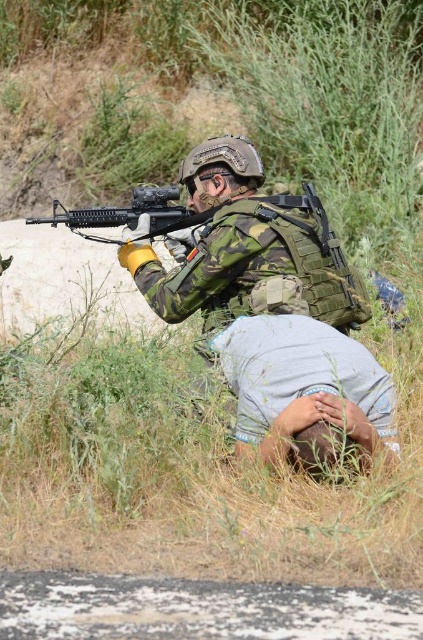
You are a military observer analyzing the scene. You notice the camo fabric uniform at center and the matte black rifle at center. Which object is positioned closer to your viewpoint?

The camo fabric uniform at center is closer to the viewer than the matte black rifle at center.

What are the coordinates of the camo fabric uniform at center?

The coordinates of the camo fabric uniform at center are at point (244, 252).